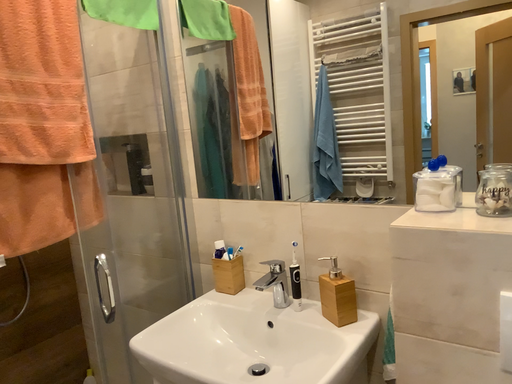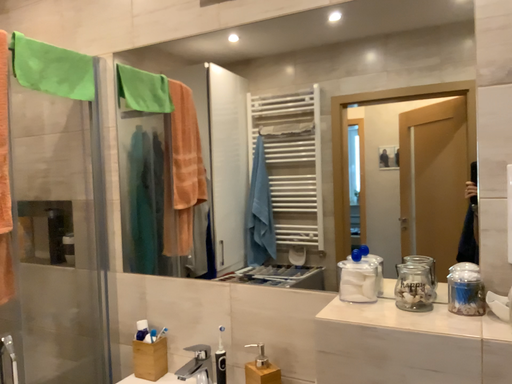
Question: Which way did the camera rotate in the video?

Choices:
 (A) rotated upward
 (B) rotated downward

Answer: (A)